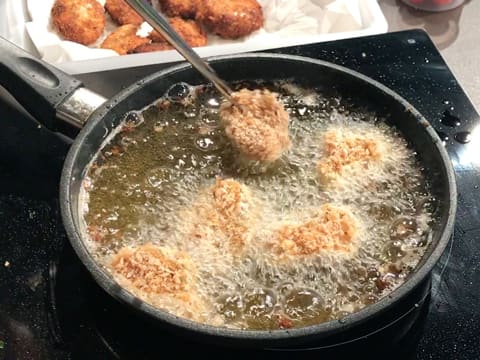
The width and height of the screenshot is (480, 360). I want to click on paper towels, so click(x=69, y=50).